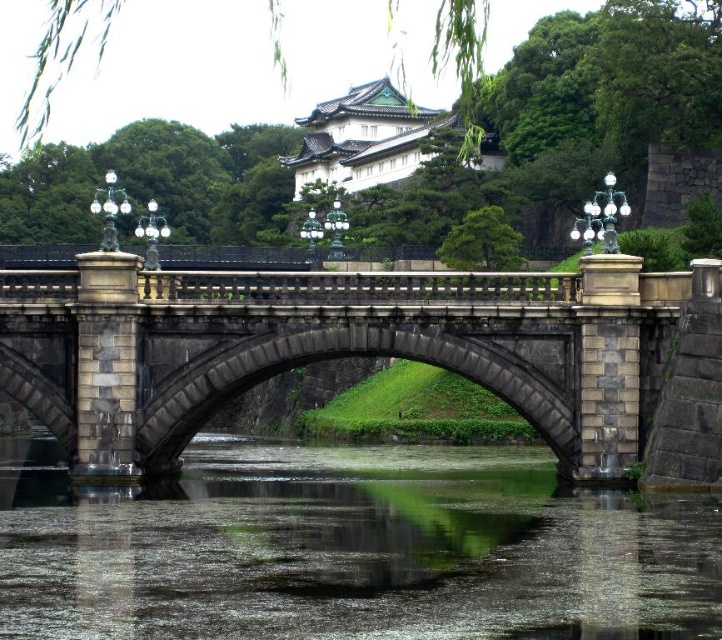
Question: Is green algae-covered water at center smaller than stone bridge at center?

Choices:
 (A) no
 (B) yes

Answer: (B)

Question: Which point is closer to the camera?

Choices:
 (A) (243, 586)
 (B) (378, 284)

Answer: (A)

Question: Does green algae-covered water at center have a lesser width compared to stone bridge at center?

Choices:
 (A) no
 (B) yes

Answer: (A)

Question: Considering the relative positions of green algae-covered water at center and stone bridge at center in the image provided, where is green algae-covered water at center located with respect to stone bridge at center?

Choices:
 (A) left
 (B) right

Answer: (A)